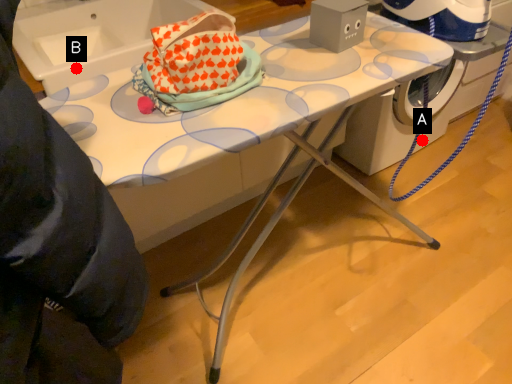
Question: Two points are circled on the image, labeled by A and B beside each circle. Which point is closer to the camera?

Choices:
 (A) A is closer
 (B) B is closer

Answer: (B)